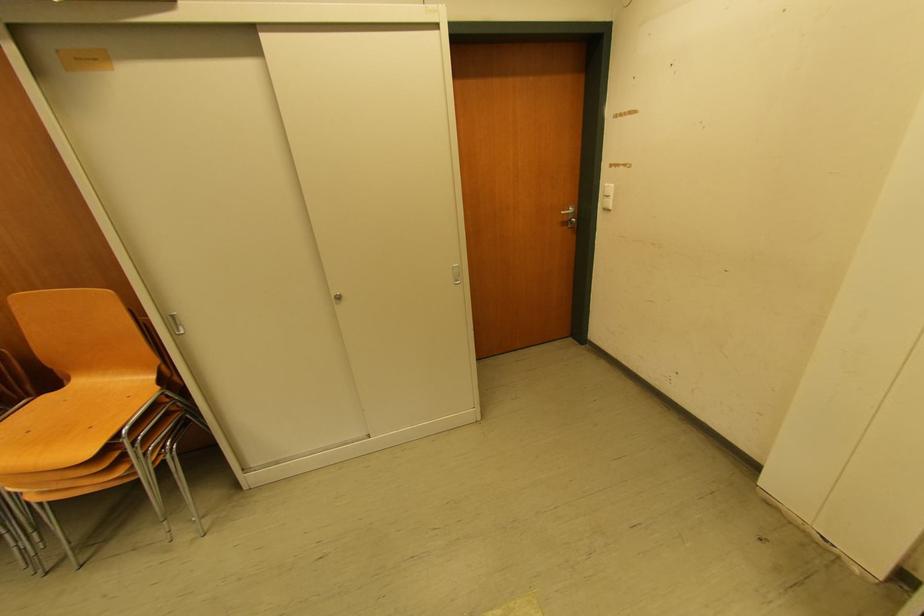
In order to click on cabinet lock in this screenshot , I will do `click(337, 297)`.